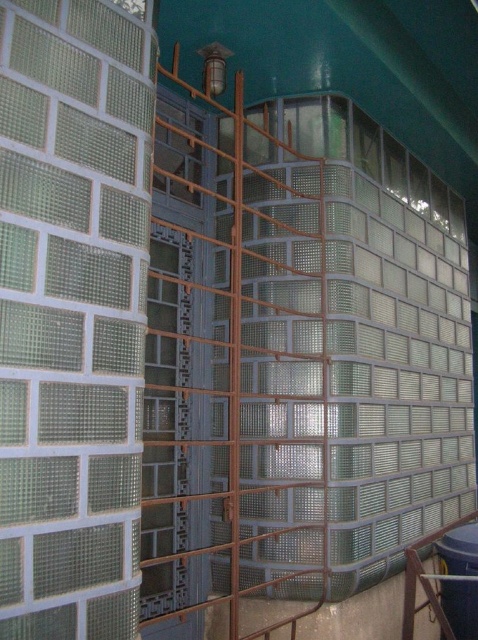
Can you confirm if brown metal cage at center is positioned to the right of blue plastic water tank at lower right?

Incorrect, brown metal cage at center is not on the right side of blue plastic water tank at lower right.

Which of these two, brown metal cage at center or blue plastic water tank at lower right, stands taller?

brown metal cage at center is taller.

The height and width of the screenshot is (640, 478). What do you see at coordinates (236, 365) in the screenshot?
I see `brown metal cage at center` at bounding box center [236, 365].

The image size is (478, 640). I want to click on brown metal cage at center, so click(236, 365).